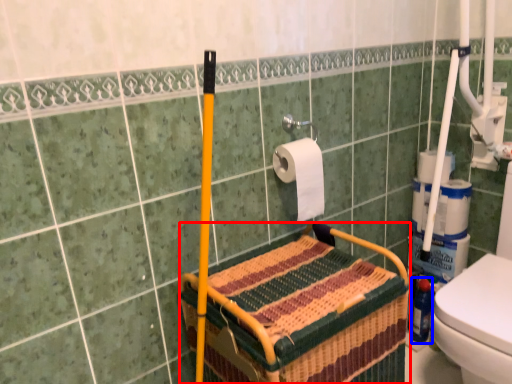
Question: Which object appears farthest to the camera in this image, crate (highlighted by a red box) or bottle (highlighted by a blue box)?

Choices:
 (A) crate
 (B) bottle

Answer: (B)